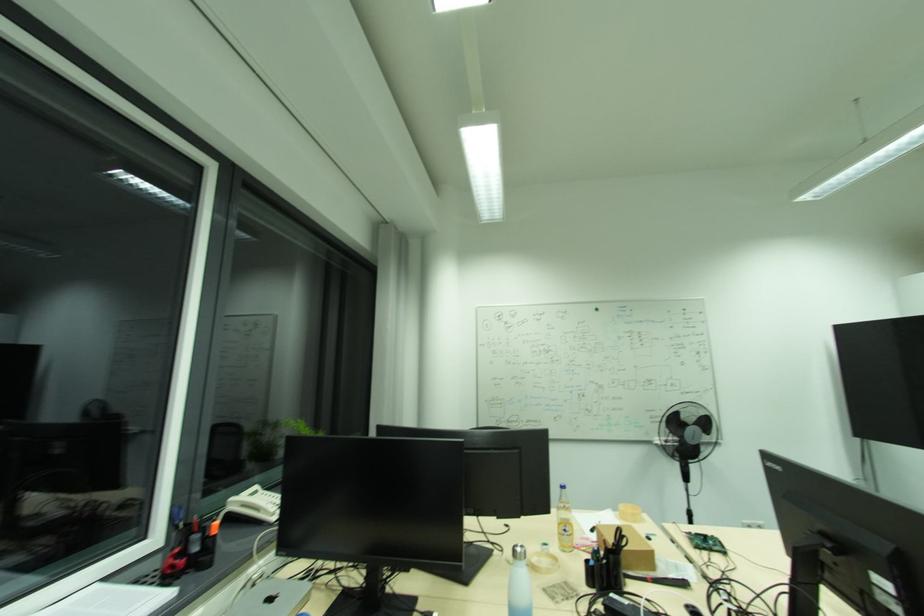
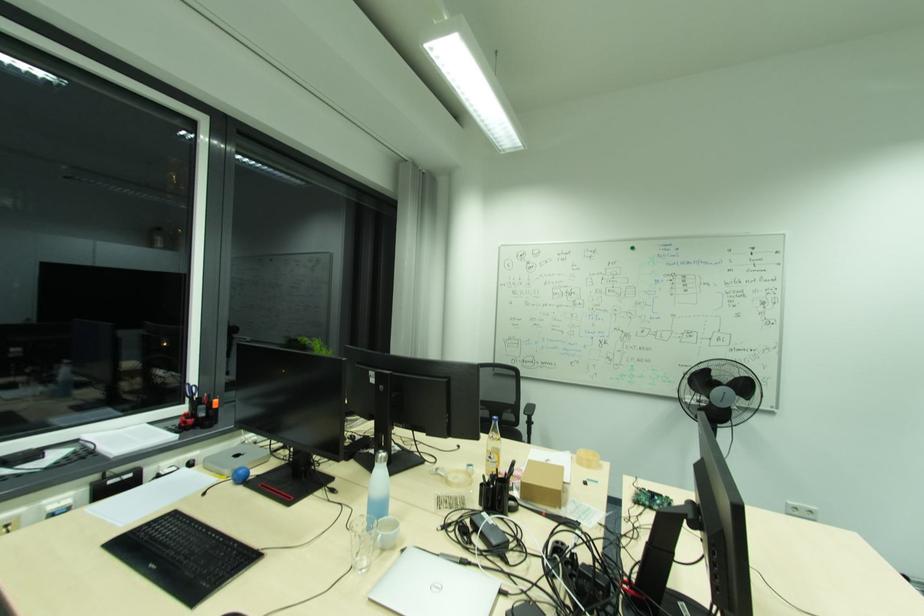
Question: How did the camera likely rotate?

Choices:
 (A) Left
 (B) Right
 (C) Up
 (D) Down

Answer: (A)